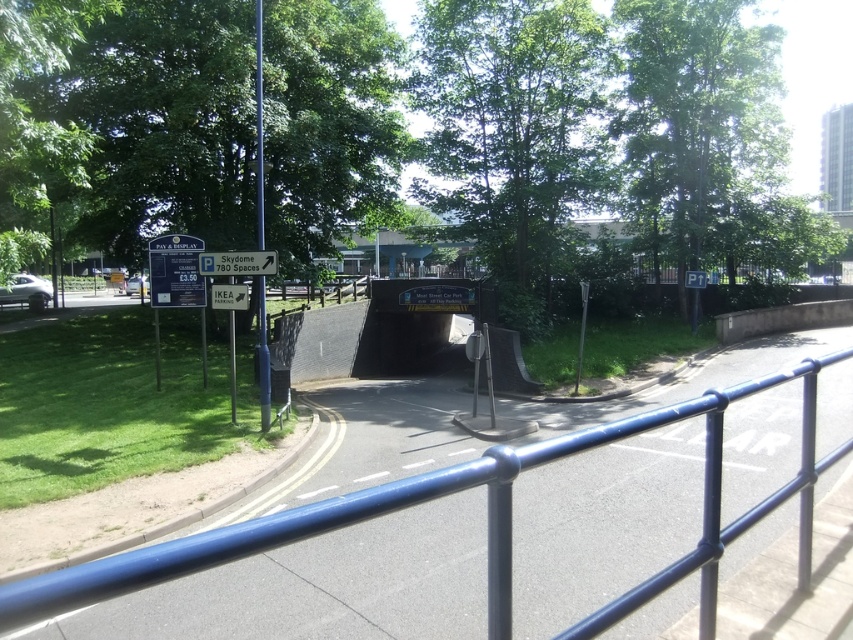
You are a delivery driver navigating the curved road bordered by a blue metal railing on the right. You need to park your vehicle near the green leafy tree at center. According to the signpost on the left, how much will it cost to park at the Skydome parking lot?

The signpost on the left indicates that parking at Skydome costs 3.50 pounds. Therefore, parking near the green leafy tree at center will cost 3.50 pounds.

You are driving a car that is 4 meters long. You need to park your car in the parking lot near the tunnel. The parking space you want to enter is marked by the matte black car at left. Can your car fit into that space without hitting the green leafy tree at upper left?

The green leafy tree at upper left is 4.53 meters from the matte black car at left. Since your car is 4 meters long, there is enough space between them for your car to fit without hitting the tree.